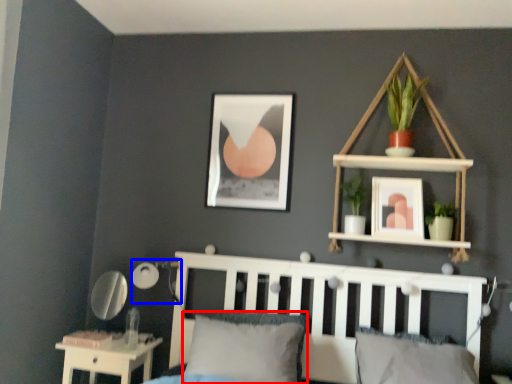
Question: Which object appears closest to the camera in this image, pillow (highlighted by a red box) or lamp (highlighted by a blue box)?

Choices:
 (A) pillow
 (B) lamp

Answer: (A)